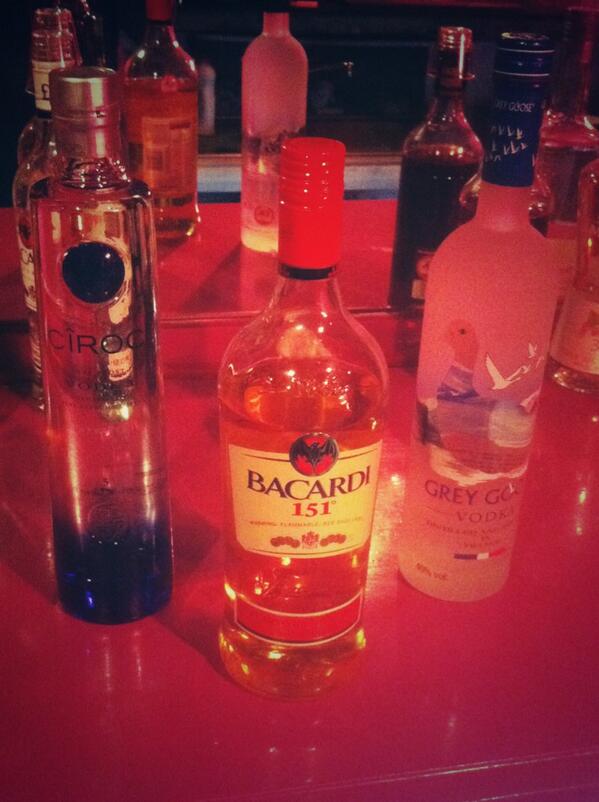
Image resolution: width=599 pixels, height=802 pixels. What are the coordinates of `vodka bottle` in the screenshot? It's located at (477, 479).